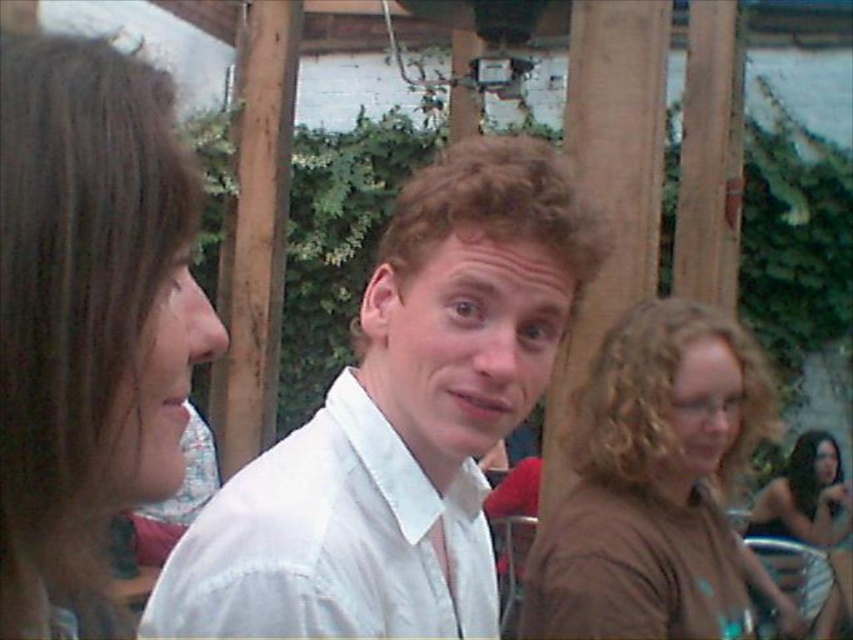
Question: Can you confirm if white cotton shirt at center is smaller than white cotton dress shirt at center?

Choices:
 (A) yes
 (B) no

Answer: (B)

Question: Which of the following is the farthest from the observer?

Choices:
 (A) (177, 252)
 (B) (614, 504)
 (C) (421, 634)
 (D) (625, 330)

Answer: (D)

Question: Which point is closer to the camera?

Choices:
 (A) white cotton dress shirt at center
 (B) silver metallic bikini at lower right

Answer: (A)

Question: Which of the following is the closest to the observer?

Choices:
 (A) brown curly hair at upper right
 (B) white cotton shirt at center
 (C) brown matte shirt at center
 (D) silver metallic bikini at lower right

Answer: (B)

Question: Is brown matte shirt at center behind silver metallic bikini at lower right?

Choices:
 (A) no
 (B) yes

Answer: (A)

Question: Is white cotton dress shirt at center to the right of silver metallic bikini at lower right from the viewer's perspective?

Choices:
 (A) yes
 (B) no

Answer: (B)